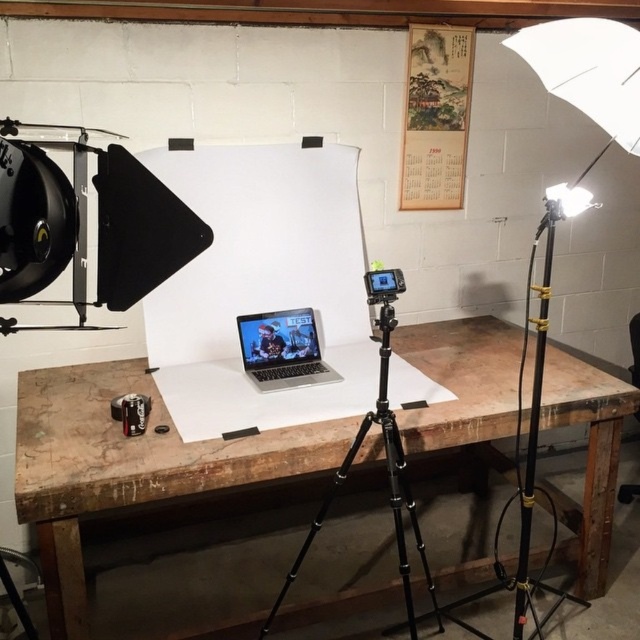
You are setting up a camera to film a product demonstration. The camera is placed at eye level with the wooden table at center. Will the camera need to tilt upwards or downwards to focus on the silver metallic laptop at center?

The wooden table at center is taller than the silver metallic laptop at center, so the camera will need to tilt downwards to focus on the silver metallic laptop at center.

You are setting up a camera on the black metal tripod at center. The camera requires a flat surface to be placed on the tripod. Is the wooden table at center wide enough to accommodate the tripod?

The wooden table at center might be wider than black metal tripod at center, so it is possible that the wooden table at center has enough space to place the black metal tripod at center on it. However, the exact dimensions are uncertain due to the description using the word

You are a photographer setting up a studio in this basement. You have a camera that needs to be placed on the black metal tripod at center. The camera requires a minimum distance of 5 feet between the tripod and the laptop to avoid interference. Is the current setup meeting this requirement?

The black metal tripod at center and camera are 5.12 feet apart from each other, which exceeds the minimum required distance of 5 feet. Therefore, the current setup meets the requirement.